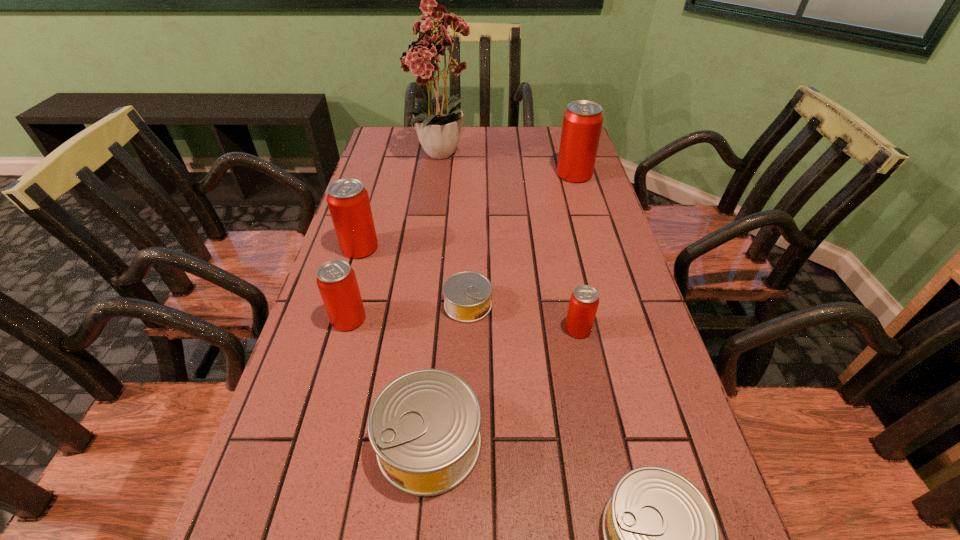
At what (x,y) coordinates should I click in order to perform the action: click on silver can that stands as the second closest to the second tallest object. Please return your answer as a coordinate pair (x, y). The width and height of the screenshot is (960, 540). Looking at the image, I should click on (424, 426).

The width and height of the screenshot is (960, 540). I want to click on blank area in the image that satisfies the following two spatial constraints: 1. on the front-facing side of the tallest object; 2. on the left side of the biggest red can, so click(441, 174).

What are the coordinates of `free space in the image that satisfies the following two spatial constraints: 1. on the front-facing side of the pink flower arrangement; 2. on the left side of the tallest can` in the screenshot? It's located at (441, 174).

At what (x,y) coordinates should I click in order to perform the action: click on vacant position in the image that satisfies the following two spatial constraints: 1. on the front side of the second red can from right to left; 2. on the left side of the third tallest object. Please return your answer as a coordinate pair (x, y). The height and width of the screenshot is (540, 960). Looking at the image, I should click on (335, 329).

This screenshot has width=960, height=540. In order to click on vacant area in the image that satisfies the following two spatial constraints: 1. on the front-facing side of the farthest silver can; 2. on the left side of the flower arrangement in this screenshot , I will do `click(425, 305)`.